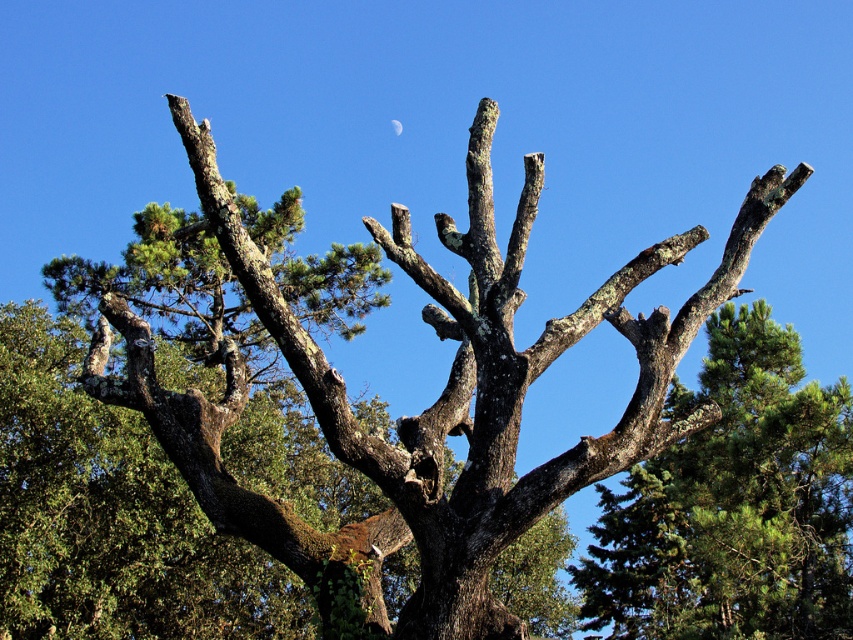
Between green mossy branch at center and silver metallic moon at upper center, which one is positioned lower?

green mossy branch at center is below.

Does green mossy branch at center have a smaller size compared to silver metallic moon at upper center?

No, green mossy branch at center is not smaller than silver metallic moon at upper center.

Where is `green mossy branch at center`? The height and width of the screenshot is (640, 853). green mossy branch at center is located at coordinates (733, 504).

You are a GUI agent. You are given a task and a screenshot of the screen. Output one action in this format:
    pyautogui.click(x=<x>, y=<y>)
    Task: Click on the green mossy branch at center
    
    Given the screenshot: What is the action you would take?
    pyautogui.click(x=733, y=504)